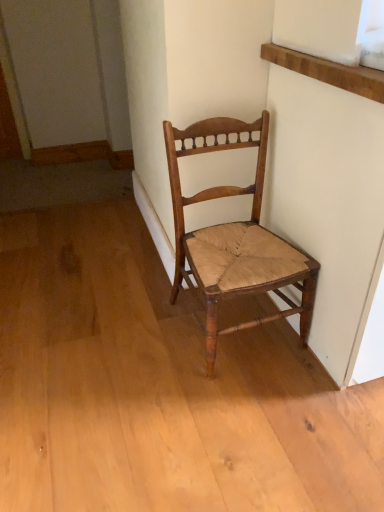
Find the location of a particular element. This screenshot has width=384, height=512. vacant location below natural wood chair at center (from a real-world perspective) is located at coordinates (252, 342).